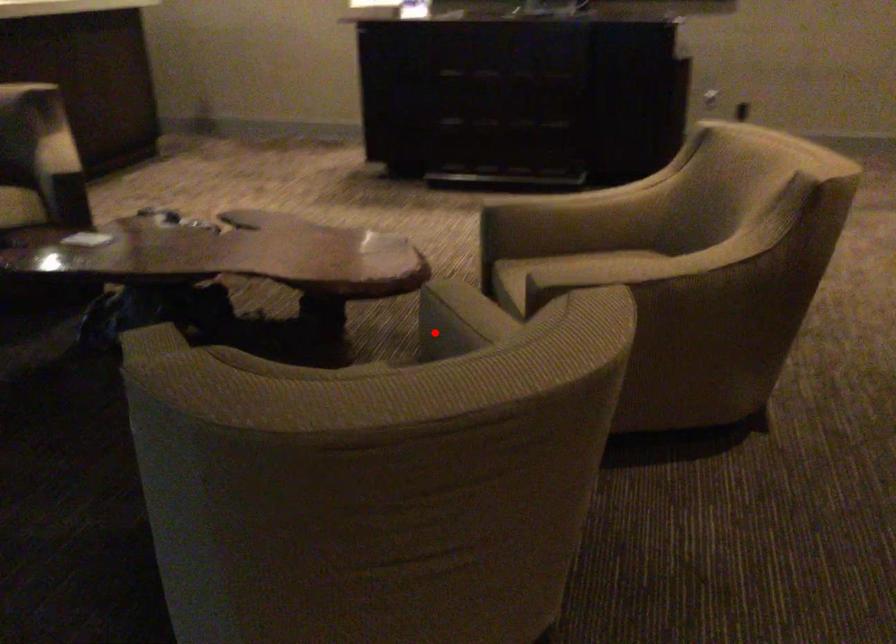
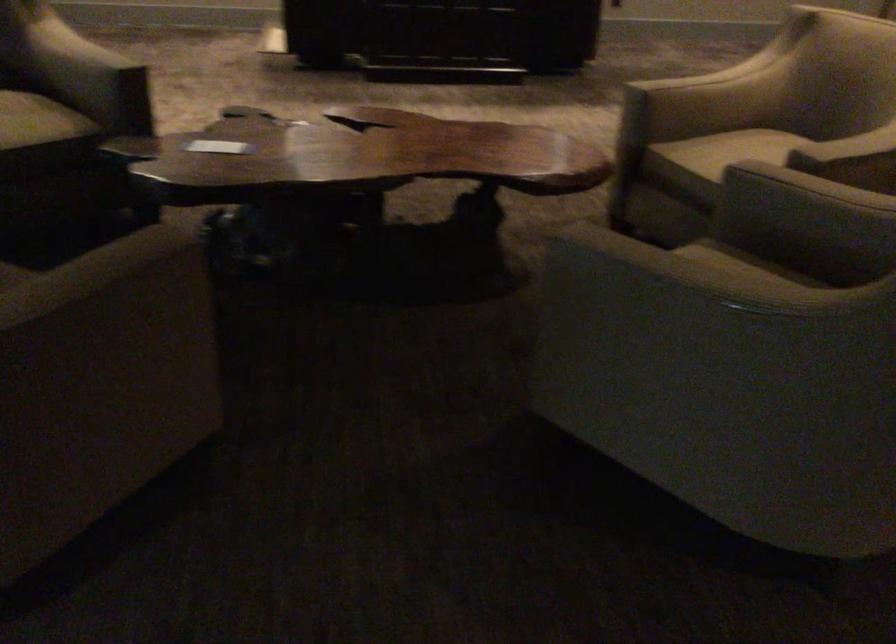
Find the pixel in the second image that matches the highlighted location in the first image.

(806, 207)